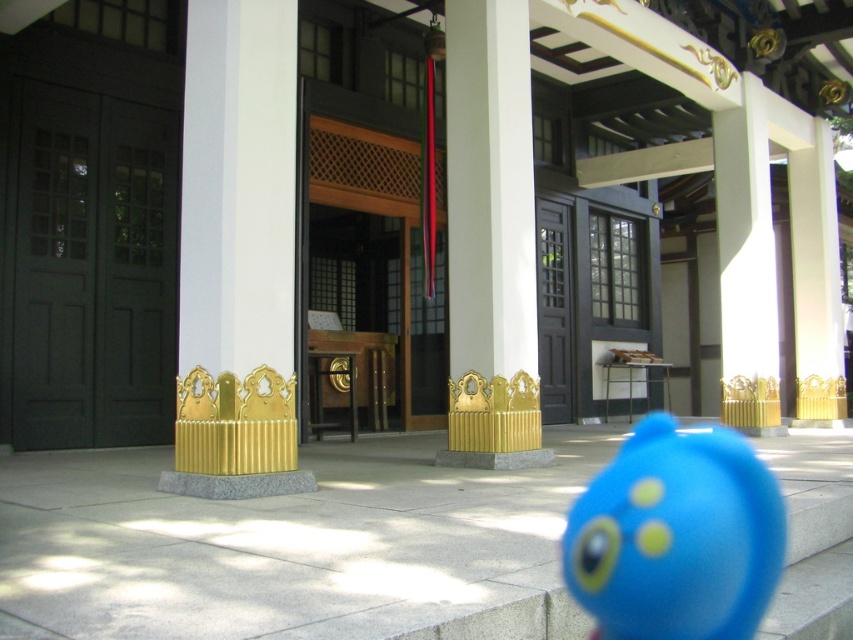
Is gold metallic pillar at center taller than blue rubber toy at center?

Yes.

Between gold metallic pillar at center and blue rubber toy at center, which one has less height?

blue rubber toy at center

Find the location of `gold metallic pillar at center`. gold metallic pillar at center is located at coordinates point(490,240).

Between matte dark green door at left and gold metallic pillar at center, which one is positioned lower?

Positioned lower is matte dark green door at left.

Is matte dark green door at left wider than gold metallic pillar at center?

Indeed, matte dark green door at left has a greater width compared to gold metallic pillar at center.

Describe the element at coordinates (90, 272) in the screenshot. I see `matte dark green door at left` at that location.

You are a GUI agent. You are given a task and a screenshot of the screen. Output one action in this format:
    pyautogui.click(x=<x>, y=<y>)
    Task: Click on the matte dark green door at left
    
    Given the screenshot: What is the action you would take?
    pyautogui.click(x=90, y=272)

Consider the image. Who is higher up, matte dark green door at left or blue rubber toy at center?

matte dark green door at left is above.

Between matte dark green door at left and blue rubber toy at center, which one has more height?

matte dark green door at left is taller.

Is point (44, 321) less distant than point (717, 572)?

No, (44, 321) is further to viewer.

Find the location of a particular element. The height and width of the screenshot is (640, 853). matte dark green door at left is located at coordinates tap(90, 272).